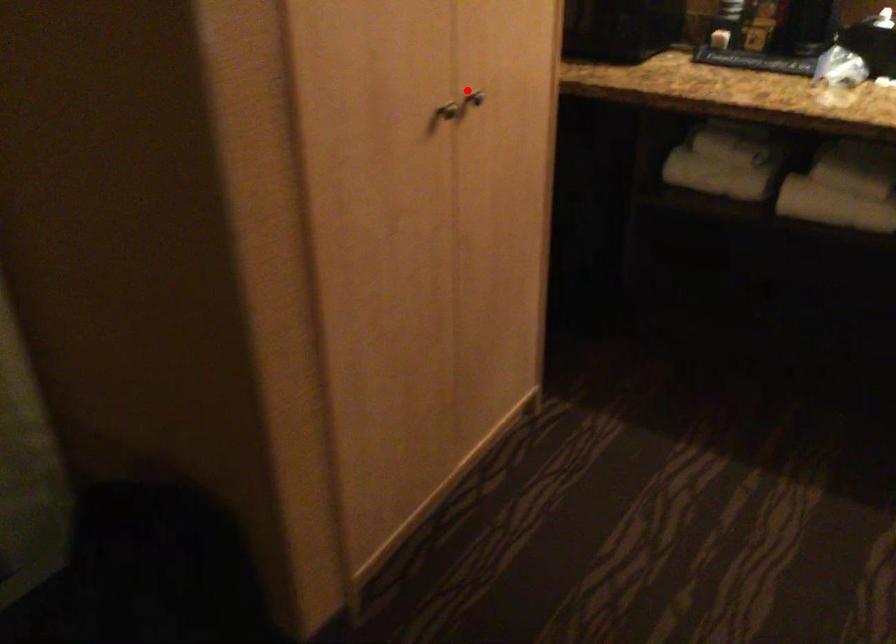
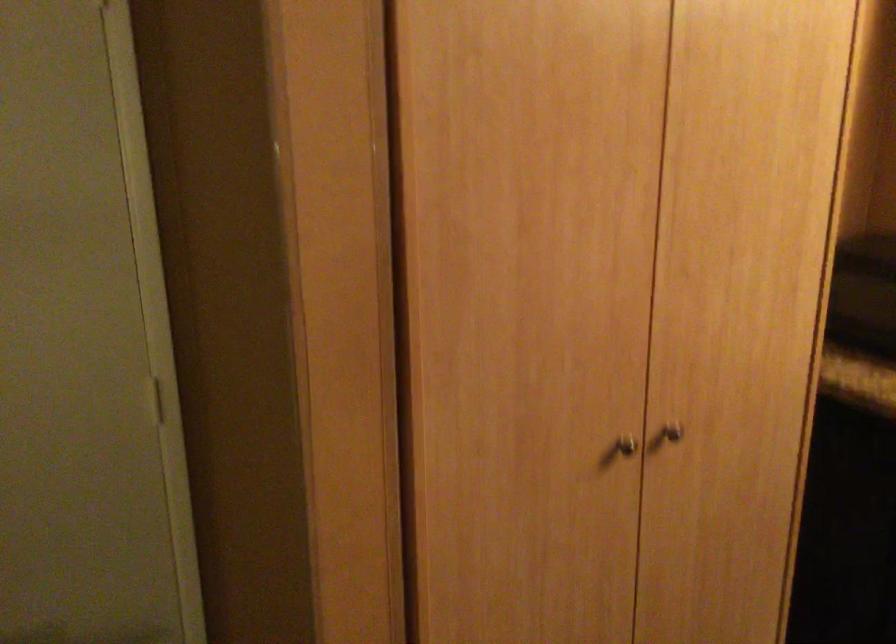
Question: I am providing you with two images of the same scene from different viewpoints. A red point is shown in image1. For the corresponding object point in image2, is it positioned nearer or farther from the camera?

Choices:
 (A) Nearer
 (B) Farther

Answer: (A)